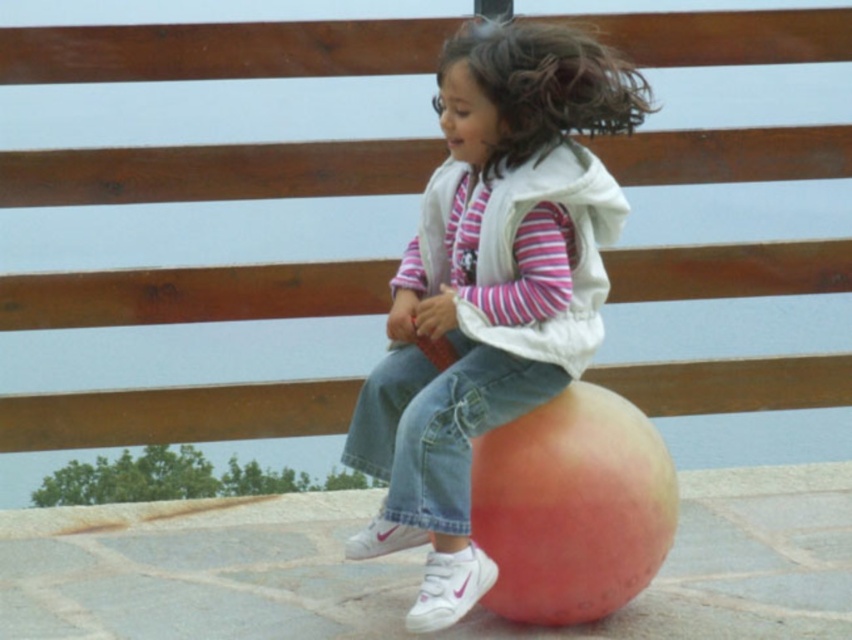
Question: Which point is farther to the camera?

Choices:
 (A) (459, 148)
 (B) (494, 29)
 (C) (448, 424)
 (D) (586, 227)

Answer: (D)

Question: Which object is positioned farthest from the jeans at center?

Choices:
 (A) white fleece vest at center
 (B) curly brown hair at upper center

Answer: (B)

Question: Can you confirm if pink matte ball at center is positioned above curly brown hair at upper center?

Choices:
 (A) yes
 (B) no

Answer: (B)

Question: Is pink matte ball at center further to camera compared to jeans at center?

Choices:
 (A) yes
 (B) no

Answer: (B)

Question: Does jeans at center appear over white fleece vest at center?

Choices:
 (A) yes
 (B) no

Answer: (B)

Question: Which object is positioned closest to the white fleece vest at center?

Choices:
 (A) jeans at center
 (B) pink matte ball at center
 (C) curly brown hair at upper center

Answer: (B)